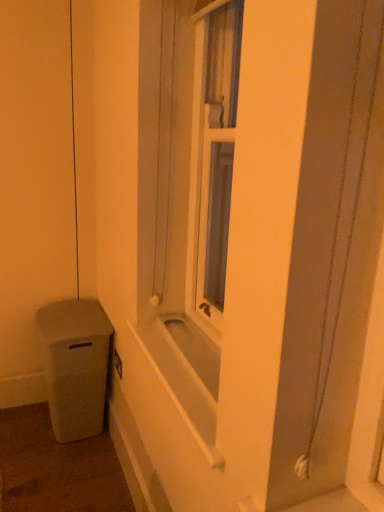
This screenshot has height=512, width=384. What are the coordinates of `matte gray trash can at lower left` in the screenshot? It's located at (75, 366).

Describe the element at coordinates (75, 366) in the screenshot. The width and height of the screenshot is (384, 512). I see `matte gray trash can at lower left` at that location.

The width and height of the screenshot is (384, 512). I want to click on white matte bathtub at center, so click(x=183, y=379).

The width and height of the screenshot is (384, 512). What do you see at coordinates (183, 379) in the screenshot?
I see `white matte bathtub at center` at bounding box center [183, 379].

The width and height of the screenshot is (384, 512). In order to click on matte gray trash can at lower left in this screenshot , I will do `click(75, 366)`.

Considering the positions of objects white matte bathtub at center and matte gray trash can at lower left in the image provided, who is more to the left, white matte bathtub at center or matte gray trash can at lower left?

matte gray trash can at lower left.

Between white matte bathtub at center and matte gray trash can at lower left, which one is positioned behind?

matte gray trash can at lower left is further away from the camera.

Is point (206, 441) closer to viewer compared to point (66, 301)?

Yes, it is.

From the image's perspective, is white matte bathtub at center on top of matte gray trash can at lower left?

Yes, from the image's perspective, white matte bathtub at center is on top of matte gray trash can at lower left.

From a real-world perspective, is white matte bathtub at center physically above matte gray trash can at lower left?

Yes.

Which object is thinner, white matte bathtub at center or matte gray trash can at lower left?

white matte bathtub at center.

Is white matte bathtub at center taller or shorter than matte gray trash can at lower left?

Considering their sizes, white matte bathtub at center has less height than matte gray trash can at lower left.

Considering the sizes of objects white matte bathtub at center and matte gray trash can at lower left in the image provided, who is bigger, white matte bathtub at center or matte gray trash can at lower left?

With larger size is matte gray trash can at lower left.

Is white matte bathtub at center surrounding matte gray trash can at lower left?

Actually, matte gray trash can at lower left is outside white matte bathtub at center.

Is white matte bathtub at center far from matte gray trash can at lower left?

They are positioned close to each other.

Could you tell me if white matte bathtub at center is turned towards matte gray trash can at lower left?

No, white matte bathtub at center does not turn towards matte gray trash can at lower left.

How different are the orientations of white matte bathtub at center and matte gray trash can at lower left in degrees?

There is a 2.03-degree angle between the facing directions of white matte bathtub at center and matte gray trash can at lower left.

How far apart are white matte bathtub at center and matte gray trash can at lower left?

white matte bathtub at center is 27.59 inches from matte gray trash can at lower left.

I want to click on waste container below the white matte bathtub at center (from the image's perspective), so click(75, 366).

Which object is positioned more to the right, matte gray trash can at lower left or white matte bathtub at center?

white matte bathtub at center.

Is matte gray trash can at lower left positioned behind white matte bathtub at center?

Yes, matte gray trash can at lower left is behind white matte bathtub at center.

Which point is more forward, (62, 333) or (191, 431)?

The point (191, 431) is closer.

From the image's perspective, between matte gray trash can at lower left and white matte bathtub at center, who is located below?

matte gray trash can at lower left.

From a real-world perspective, is matte gray trash can at lower left above or below white matte bathtub at center?

matte gray trash can at lower left is below white matte bathtub at center.

Is matte gray trash can at lower left wider or thinner than white matte bathtub at center?

Considering their sizes, matte gray trash can at lower left looks broader than white matte bathtub at center.

Is matte gray trash can at lower left taller than white matte bathtub at center?

Indeed, matte gray trash can at lower left has a greater height compared to white matte bathtub at center.

Based on their sizes in the image, would you say matte gray trash can at lower left is bigger or smaller than white matte bathtub at center?

Considering their sizes, matte gray trash can at lower left takes up more space than white matte bathtub at center.

Is matte gray trash can at lower left completely or partially outside of white matte bathtub at center?

Yes.

Is matte gray trash can at lower left far away from white matte bathtub at center?

No, matte gray trash can at lower left is not far from white matte bathtub at center.

Is matte gray trash can at lower left turned away from white matte bathtub at center?

That's not correct — matte gray trash can at lower left is not looking away from white matte bathtub at center.

Locate an element on the screen. The image size is (384, 512). bath that appears above the matte gray trash can at lower left (from the image's perspective) is located at coordinates (183, 379).

Find the location of a particular element. bath that appears above the matte gray trash can at lower left (from the image's perspective) is located at coordinates (183, 379).

Identify the location of waste container located below the white matte bathtub at center (from the image's perspective). (75, 366).